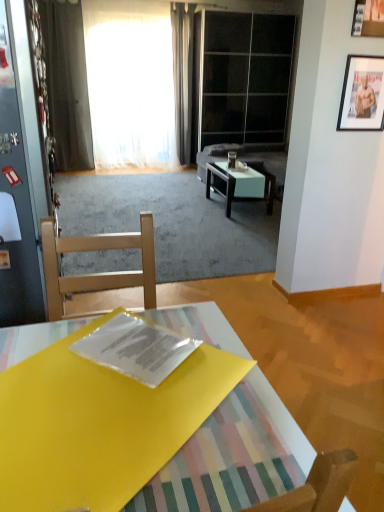
Question: From a real-world perspective, is wooden picture frame at upper right, which appears as the second picture frame when ordered from the bottom, above or below metallic glass door at left, which ranks as the first glass door in front-to-back order?

Choices:
 (A) below
 (B) above

Answer: (B)

Question: Looking at the image, does wooden picture frame at upper right, the 1th picture frame from the top, seem bigger or smaller compared to metallic glass door at left, acting as the 2th glass door starting from the right?

Choices:
 (A) big
 (B) small

Answer: (B)

Question: Which object is positioned closest to the gray fabric curtain at upper center, marked as the 1th curtain in a right-to-left arrangement?

Choices:
 (A) metallic glass door at left, the second glass door viewed from the back
 (B) yellow plastic folder at center, which is counted as the 2th coffee table, starting from the right
 (C) white glossy coffee table at center, which ranks as the 1th coffee table in right-to-left order
 (D) metallic silver picture frame at upper right, positioned as the first picture frame in bottom-to-top order
 (E) wooden picture frame at upper right, the 1th picture frame from the top

Answer: (C)

Question: Which object is positioned closest to the wooden picture frame at upper right, which appears as the second picture frame when ordered from the bottom?

Choices:
 (A) gray fabric curtain at upper center, marked as the 1th curtain in a right-to-left arrangement
 (B) transparent plastic magazine at center
 (C) yellow plastic folder at center, which is counted as the 2th coffee table, starting from the right
 (D) metallic silver picture frame at upper right, positioned as the first picture frame in back-to-front order
 (E) transparent glass door at upper center, acting as the 2th glass door starting from the left

Answer: (D)